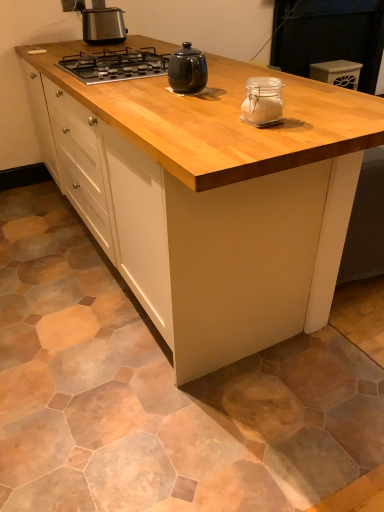
Identify the location of vacant space that is to the left of glossy ceramic mug at upper center, which appears as the second kitchen appliance when viewed from the left. (145, 94).